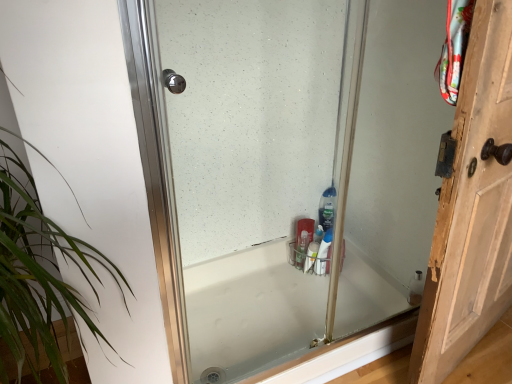
Question: Is white glossy bathtub at center wider than green leafy plant at left?

Choices:
 (A) no
 (B) yes

Answer: (B)

Question: Is white glossy bathtub at center positioned behind green leafy plant at left?

Choices:
 (A) no
 (B) yes

Answer: (B)

Question: Considering the relative sizes of white glossy bathtub at center and green leafy plant at left in the image provided, is white glossy bathtub at center taller than green leafy plant at left?

Choices:
 (A) yes
 (B) no

Answer: (B)

Question: Is white glossy bathtub at center shorter than green leafy plant at left?

Choices:
 (A) no
 (B) yes

Answer: (B)

Question: Is the position of white glossy bathtub at center less distant than that of green leafy plant at left?

Choices:
 (A) yes
 (B) no

Answer: (B)

Question: Do you think white glossy bottle at lower right, the first cleaning product viewed from the front, is within wooden door at right, or outside of it?

Choices:
 (A) outside
 (B) inside

Answer: (A)

Question: Considering the relative positions of white glossy bottle at lower right, the first cleaning product viewed from the front, and wooden door at right in the image provided, is white glossy bottle at lower right, the first cleaning product viewed from the front, to the left or to the right of wooden door at right?

Choices:
 (A) right
 (B) left

Answer: (B)

Question: From a real-world perspective, is white glossy bottle at lower right, the 1th cleaning product in the bottom-to-top sequence, above or below wooden door at right?

Choices:
 (A) above
 (B) below

Answer: (B)

Question: Considering their positions, is white glossy bottle at lower right, the 2th cleaning product positioned from the top, located in front of or behind wooden door at right?

Choices:
 (A) front
 (B) behind

Answer: (B)

Question: From the image's perspective, is green leafy plant at left located above or below white glossy bathtub at center?

Choices:
 (A) below
 (B) above

Answer: (B)

Question: In the image, is green leafy plant at left on the left side or the right side of white glossy bathtub at center?

Choices:
 (A) right
 (B) left

Answer: (B)

Question: Looking at their shapes, would you say green leafy plant at left is wider or thinner than white glossy bathtub at center?

Choices:
 (A) wide
 (B) thin

Answer: (B)

Question: Is point (39, 281) closer or farther from the camera than point (240, 271)?

Choices:
 (A) closer
 (B) farther

Answer: (A)

Question: Looking at their shapes, would you say white glossy bathtub at center is wider or thinner than green leafy plant at left?

Choices:
 (A) thin
 (B) wide

Answer: (B)

Question: In the image, is white glossy bathtub at center on the left side or the right side of green leafy plant at left?

Choices:
 (A) right
 (B) left

Answer: (A)